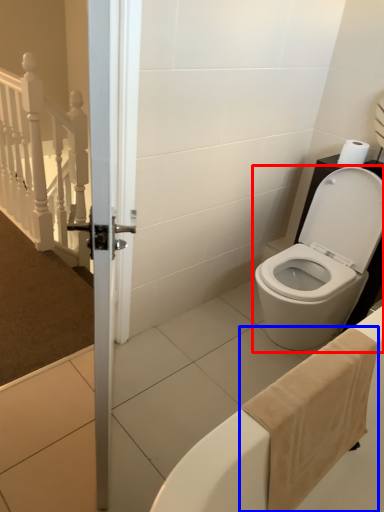
Question: Which of the following is the farthest to the observer, toilet (highlighted by a red box) or bath towel (highlighted by a blue box)?

Choices:
 (A) toilet
 (B) bath towel

Answer: (A)